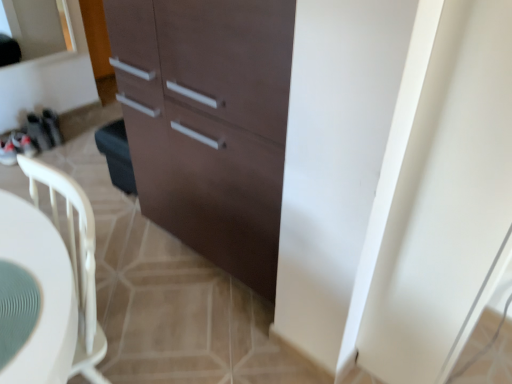
Question: Considering the relative sizes of white glossy screen door at right and teal textured placemat at lower left in the image provided, is white glossy screen door at right taller than teal textured placemat at lower left?

Choices:
 (A) no
 (B) yes

Answer: (B)

Question: Is white glossy screen door at right oriented towards teal textured placemat at lower left?

Choices:
 (A) no
 (B) yes

Answer: (A)

Question: Are white glossy screen door at right and teal textured placemat at lower left far apart?

Choices:
 (A) no
 (B) yes

Answer: (A)

Question: Is white glossy screen door at right positioned before teal textured placemat at lower left?

Choices:
 (A) no
 (B) yes

Answer: (A)

Question: From the image's perspective, is white glossy screen door at right located beneath teal textured placemat at lower left?

Choices:
 (A) yes
 (B) no

Answer: (B)

Question: Does point (49, 380) appear closer or farther from the camera than point (467, 263)?

Choices:
 (A) farther
 (B) closer

Answer: (B)

Question: From a real-world perspective, is teal textured placemat at lower left above or below white glossy screen door at right?

Choices:
 (A) above
 (B) below

Answer: (A)

Question: Is teal textured placemat at lower left in front of or behind white glossy screen door at right in the image?

Choices:
 (A) behind
 (B) front

Answer: (B)

Question: In the image, is teal textured placemat at lower left on the left side or the right side of white glossy screen door at right?

Choices:
 (A) left
 (B) right

Answer: (A)

Question: From the image's perspective, is matte brown cabinet at center positioned above or below teal textured placemat at lower left?

Choices:
 (A) above
 (B) below

Answer: (A)

Question: Relative to teal textured placemat at lower left, is matte brown cabinet at center in front or behind?

Choices:
 (A) behind
 (B) front

Answer: (A)

Question: From a real-world perspective, is matte brown cabinet at center above or below teal textured placemat at lower left?

Choices:
 (A) above
 (B) below

Answer: (B)

Question: Which is correct: matte brown cabinet at center is inside teal textured placemat at lower left, or outside of it?

Choices:
 (A) outside
 (B) inside

Answer: (A)

Question: Considering the positions of white plastic chair at center-left and white glossy screen door at right in the image, is white plastic chair at center-left bigger or smaller than white glossy screen door at right?

Choices:
 (A) small
 (B) big

Answer: (B)

Question: Considering the positions of white plastic chair at center-left and white glossy screen door at right in the image, is white plastic chair at center-left wider or thinner than white glossy screen door at right?

Choices:
 (A) thin
 (B) wide

Answer: (B)